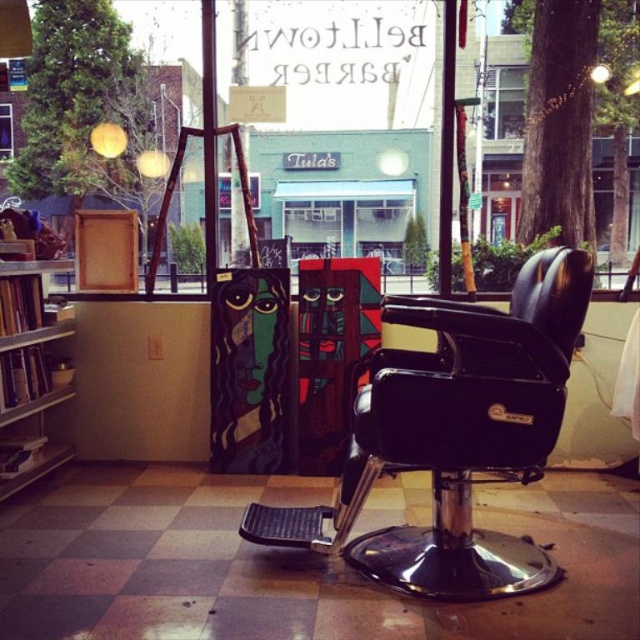
Consider the image. Is wooden bookshelf at left below clear glass window at upper center?

Indeed, wooden bookshelf at left is positioned under clear glass window at upper center.

Between point (26, 321) and point (483, 129), which one is positioned behind?

Point (483, 129)

The image size is (640, 640). What are the coordinates of `wooden bookshelf at left` in the screenshot? It's located at (28, 372).

Image resolution: width=640 pixels, height=640 pixels. Find the location of `wooden bookshelf at left`. wooden bookshelf at left is located at coordinates (28, 372).

Between point (435, 476) and point (12, 140), which one is positioned in front?

Point (435, 476) is in front.

Does black leather swivel chair at center appear under transparent glass window at upper left?

Yes.

Between point (508, 576) and point (6, 145), which one is positioned in front?

Point (508, 576) is in front.

Where is `black leather swivel chair at center`? This screenshot has height=640, width=640. black leather swivel chair at center is located at coordinates (452, 435).

Between black leather swivel chair at center and clear glass window at upper center, which one is positioned lower?

Positioned lower is black leather swivel chair at center.

The image size is (640, 640). Identify the location of black leather swivel chair at center. (452, 435).

Find the location of a particular element. black leather swivel chair at center is located at coordinates (452, 435).